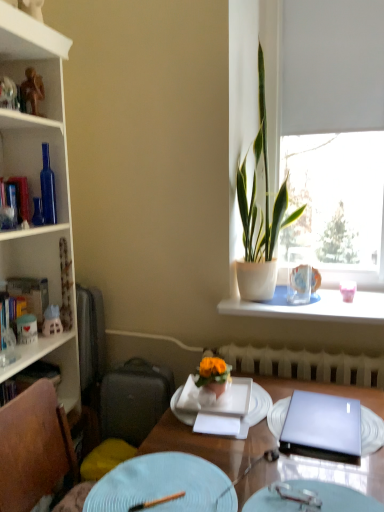
Locate an element on the screen. This screenshot has height=512, width=384. vacant space to the right of white paper at center is located at coordinates (269, 429).